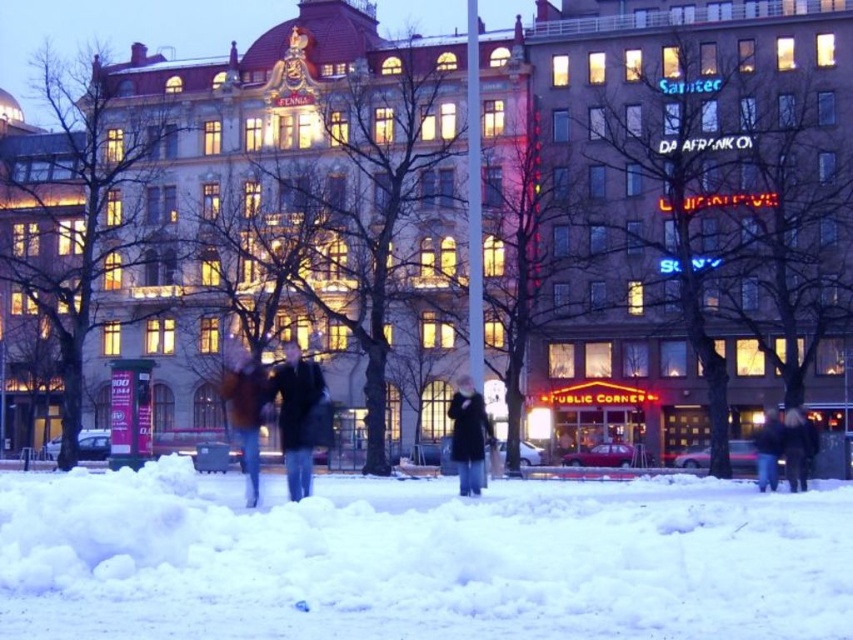
Is white fluffy snow at lower center further to the viewer compared to brick building at right?

That is False.

Is point (97, 556) farther from camera compared to point (606, 292)?

No, (97, 556) is closer to viewer.

The image size is (853, 640). I want to click on white fluffy snow at lower center, so point(418,557).

Does white fluffy snow at lower center appear under dark brown fur coat at lower right?

Indeed, white fluffy snow at lower center is positioned under dark brown fur coat at lower right.

Does point (61, 499) come closer to viewer compared to point (784, 436)?

Yes, point (61, 499) is closer to viewer.

What are the coordinates of `white fluffy snow at lower center` in the screenshot? It's located at (418, 557).

Which is below, brown fuzzy coat at center or dark brown fur coat at lower right?

Positioned lower is brown fuzzy coat at center.

Is brown fuzzy coat at center below dark brown fur coat at lower right?

Yes.

Find the location of a particular element. brown fuzzy coat at center is located at coordinates (245, 412).